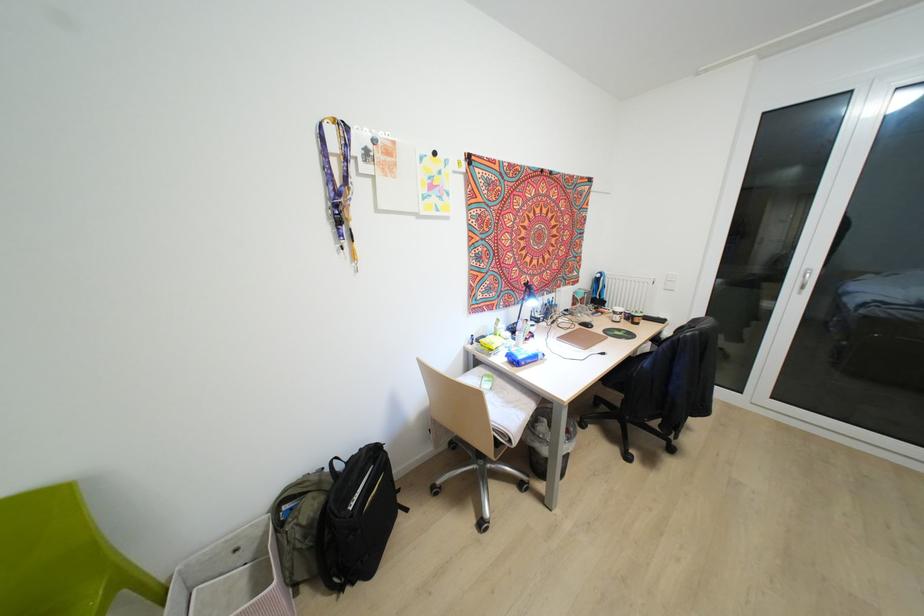
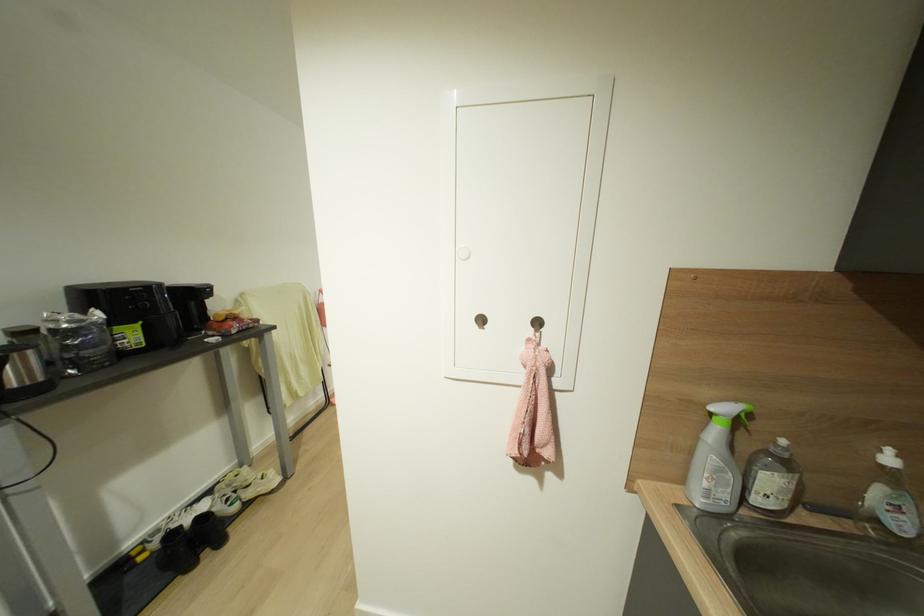
Question: I am providing you with two images of the same scene from different viewpoints. Please identify which objects are invisible in image2.

Choices:
 (A) soap dispenser pump
 (B) small food jar
 (C) pink salt block
 (D) white sneaker

Answer: (B)